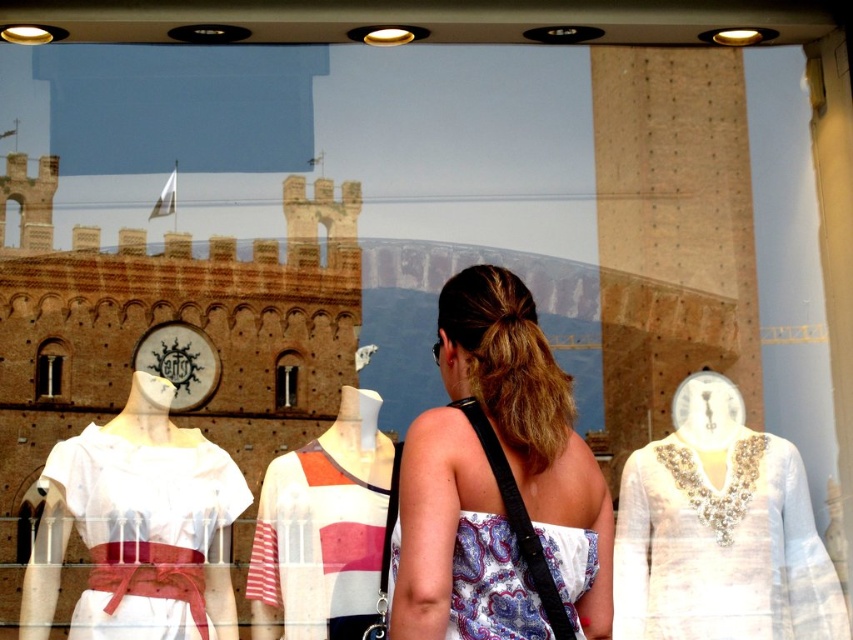
Can you confirm if striped cotton dress at center is positioned below smooth stone arch at center?

Yes, striped cotton dress at center is below smooth stone arch at center.

Is point (282, 484) behind point (45, 358)?

No.

Does point (280, 608) come closer to viewer compared to point (42, 342)?

That is True.

Find the location of a particular element. striped cotton dress at center is located at coordinates (318, 547).

Does white cotton dress at left lie behind smooth stone arch at center?

No, it is not.

Can you confirm if white cotton dress at left is positioned to the left of smooth stone arch at center?

Incorrect, white cotton dress at left is not on the left side of smooth stone arch at center.

Locate an element on the screen. white cotton dress at left is located at coordinates 142,532.

Which of these two, paisley fabric dress at center or striped cotton dress at center, stands taller?

Standing taller between the two is paisley fabric dress at center.

Between paisley fabric dress at center and striped cotton dress at center, which one is positioned higher?

paisley fabric dress at center is above.

You are a GUI agent. You are given a task and a screenshot of the screen. Output one action in this format:
    pyautogui.click(x=<x>, y=<y>)
    Task: Click on the paisley fabric dress at center
    
    Given the screenshot: What is the action you would take?
    pyautogui.click(x=498, y=484)

The width and height of the screenshot is (853, 640). In order to click on paisley fabric dress at center in this screenshot , I will do `click(498, 484)`.